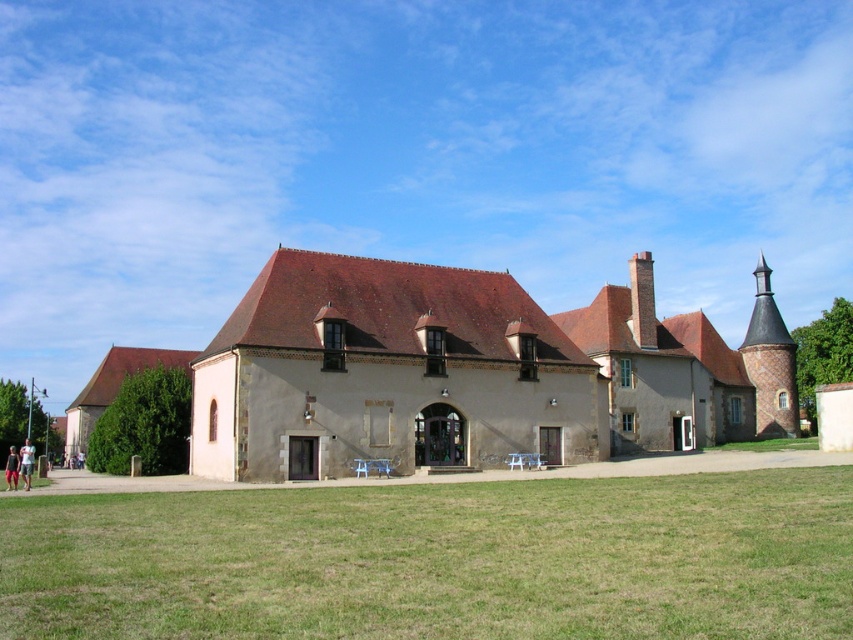
Is green grass at lower center smaller than brick chimney at center?

No.

Is point (672, 592) in front of point (637, 308)?

Yes.

Locate an element on the screen. This screenshot has height=640, width=853. green grass at lower center is located at coordinates (439, 560).

Does green grass at lower center have a larger size compared to brown brick chimney at upper right?

No, green grass at lower center is not bigger than brown brick chimney at upper right.

Is green grass at lower center thinner than brown brick chimney at upper right?

Yes, green grass at lower center is thinner than brown brick chimney at upper right.

The height and width of the screenshot is (640, 853). What are the coordinates of `green grass at lower center` in the screenshot? It's located at coord(439,560).

Does brown brick chimney at upper right have a larger size compared to brick chimney at center?

Indeed, brown brick chimney at upper right has a larger size compared to brick chimney at center.

Can you confirm if brown brick chimney at upper right is positioned below brick chimney at center?

Indeed, brown brick chimney at upper right is positioned under brick chimney at center.

This screenshot has height=640, width=853. Describe the element at coordinates (770, 362) in the screenshot. I see `brown brick chimney at upper right` at that location.

Where is `brown brick chimney at upper right`? Image resolution: width=853 pixels, height=640 pixels. brown brick chimney at upper right is located at coordinates (770, 362).